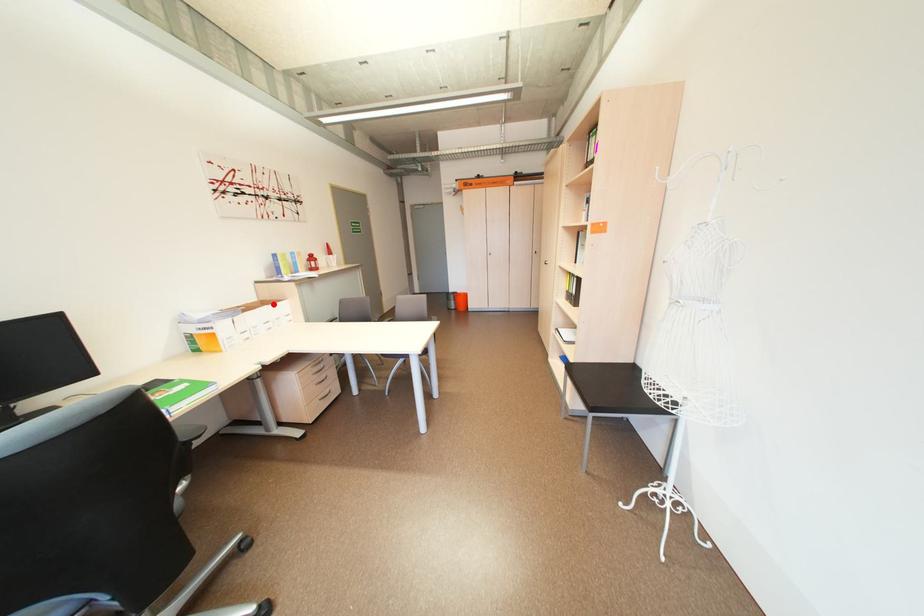
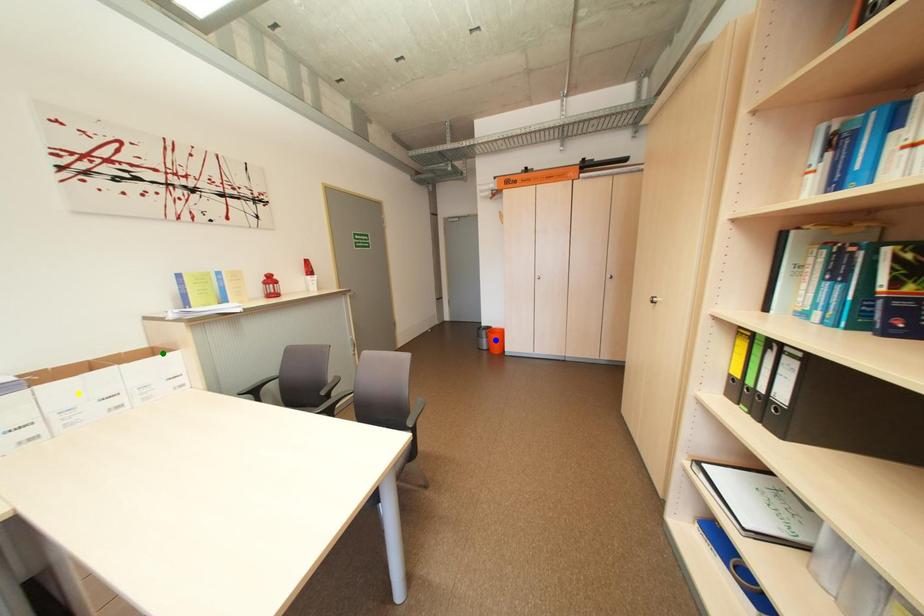
Question: I am providing you with two images of the same scene from different viewpoints. A red point is marked on the first image. You are given multiple points on the second image. Which mark in image 2 goes with the point in image 1?

Choices:
 (A) green point
 (B) yellow point
 (C) blue point

Answer: (A)